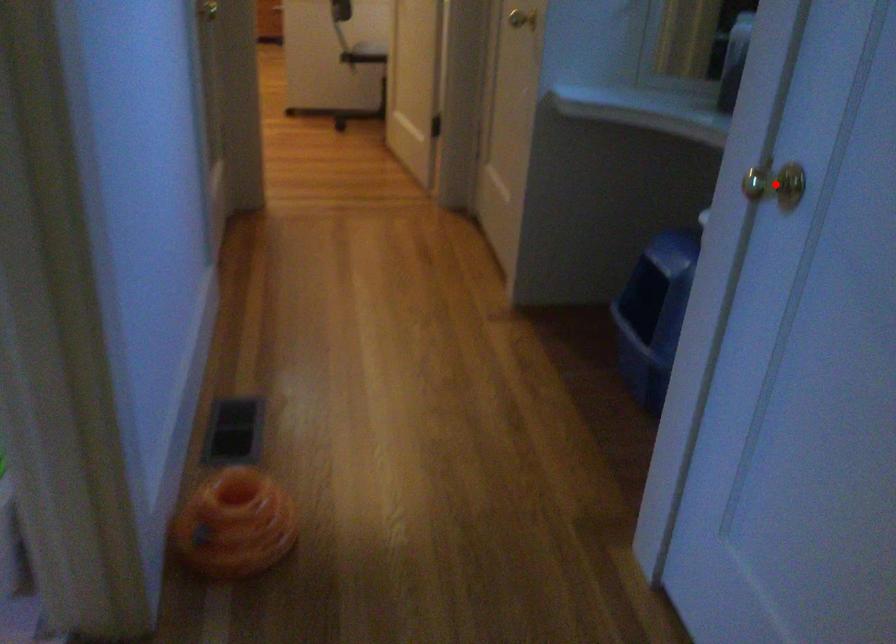
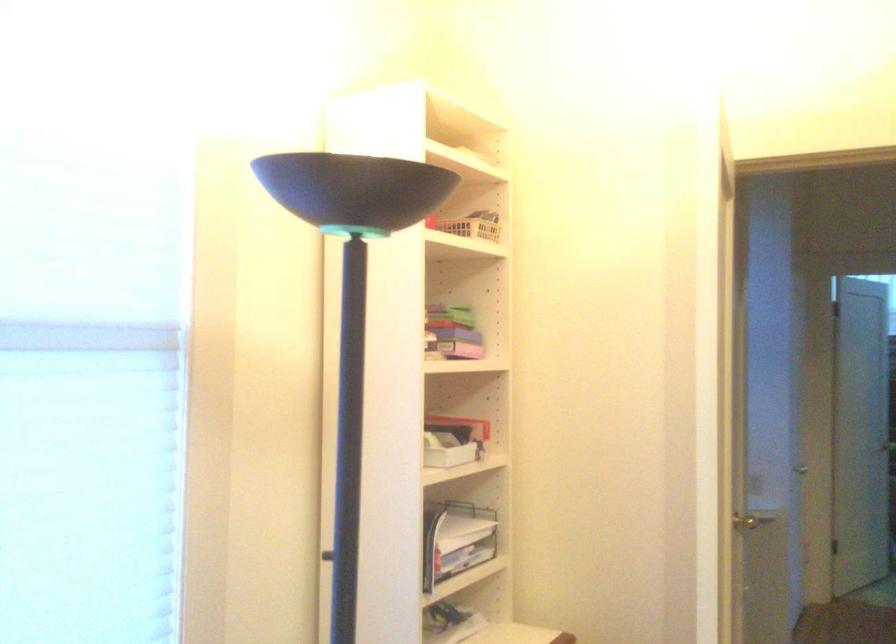
Question: I am providing you with two images of the same scene from different viewpoints. A red point is marked on the first image. Is the red point's position out of view in image 2?

Choices:
 (A) Yes
 (B) No

Answer: (A)